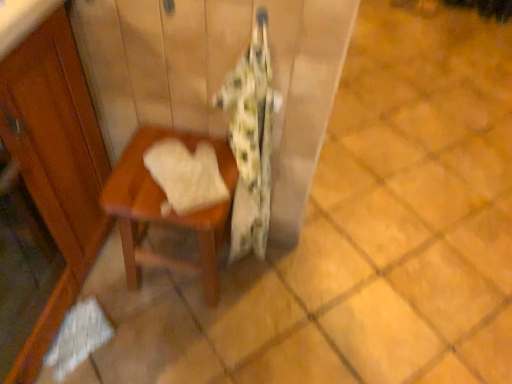
Locate an element on the screen. The width and height of the screenshot is (512, 384). vacant area that is in front of wooden table at center is located at coordinates (179, 343).